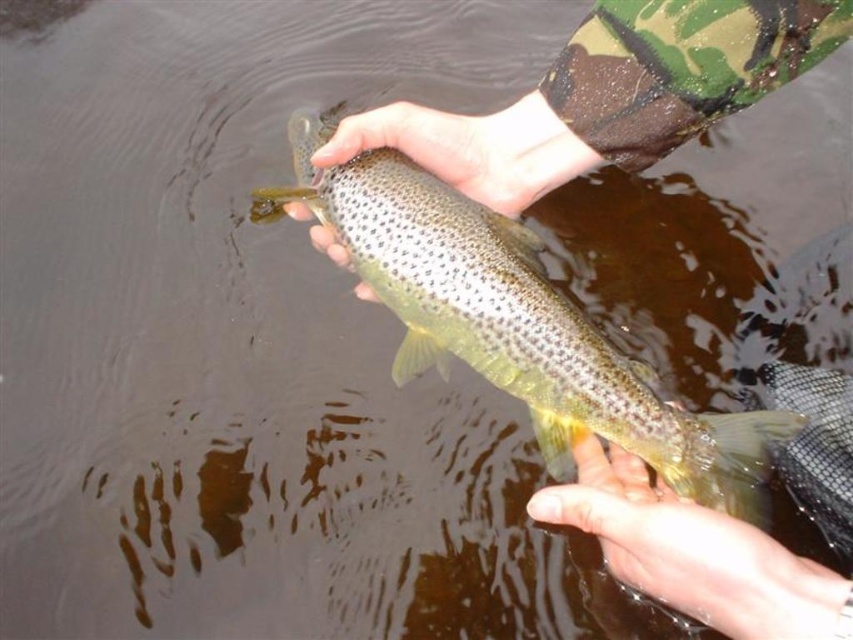
You are a photographer trying to capture the speckled goldfish at center and the smooth skin hand at lower right in focus. Which object should you adjust your camera focus on first to ensure both are in focus?

The speckled goldfish at center is further to the viewer than the smooth skin hand at lower right, so you should focus on the speckled goldfish at center first to ensure both are in focus.

You are a fisherman who just caught a trout. You want to measure the trout using your hands. You have a smooth skin hand at lower right and a smooth skin hand at center. Which hand should you use to get a more accurate measurement of the trout?

The smooth skin hand at lower right is bigger than the smooth skin hand at center, so you should use the smooth skin hand at lower right to get a more accurate measurement of the trout.

You are a photographer trying to capture the fish in the image. You notice two points marked on the fish. Which point, point 1 at coordinates point (x=395, y=276) or point 2 at coordinates point (x=467, y=192), is closer to the camera lens?

Point 1 at coordinates point (x=395, y=276) is closer to the viewer than point 2 at coordinates point (x=467, y=192), so it is closer to the camera lens.